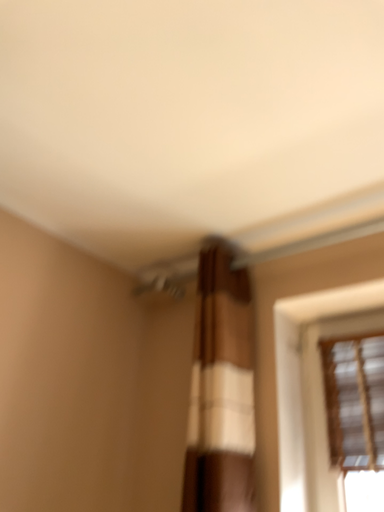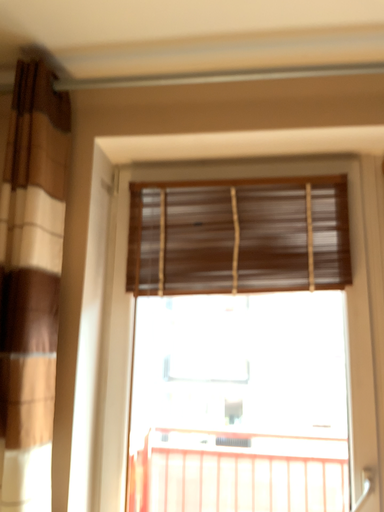
Question: Which way did the camera rotate in the video?

Choices:
 (A) rotated left
 (B) rotated right

Answer: (B)